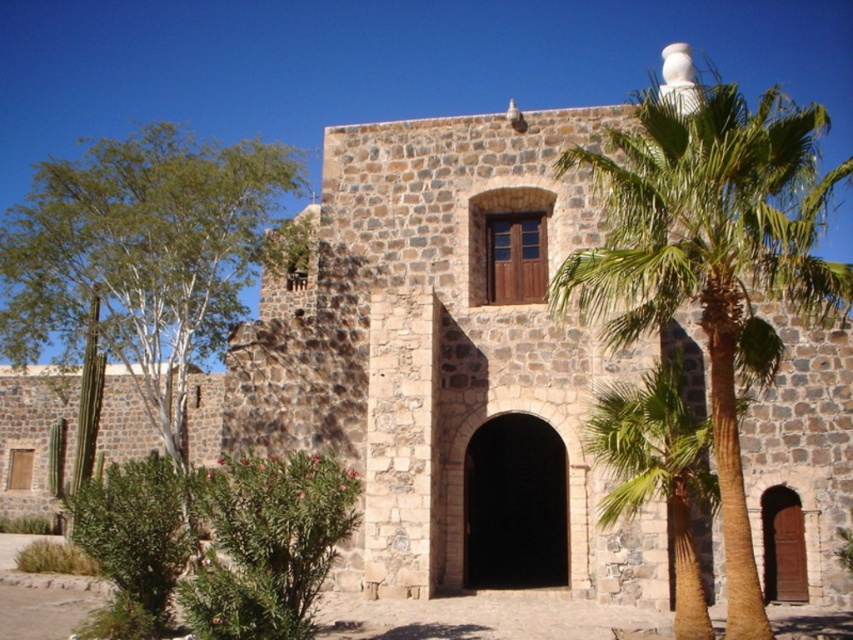
You are standing in front of the rustic stone building and want to water the green leafy palm tree at upper right and the green leafy palm tree at center. Which palm tree should you water first if you want to start from the one closer to the ground?

The green leafy palm tree at center should be watered first because it is located below the green leafy palm tree at upper right, making it closer to the ground.

You are standing in front of the rustic stone building and need to water the plants. The watering can you have can reach up to 5 meters. Can you water both the green leafy palm tree at upper right and the green leafy palm tree at center without moving the can?

The green leafy palm tree at upper right is 4.59 meters away from green leafy palm tree at center. Since the watering can can reach up to 5 meters, you can water both trees without moving the can because the distance between them is within the can reach.